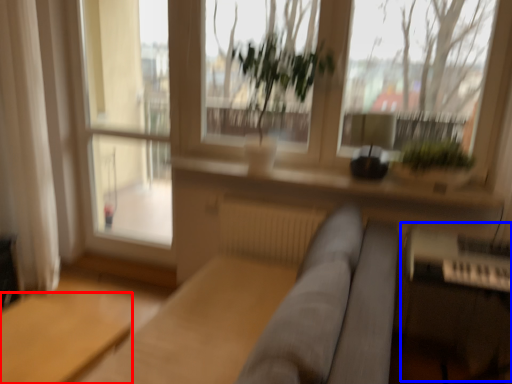
Question: Among these objects, which one is nearest to the camera, table (highlighted by a red box) or piano (highlighted by a blue box)?

Choices:
 (A) table
 (B) piano

Answer: (A)